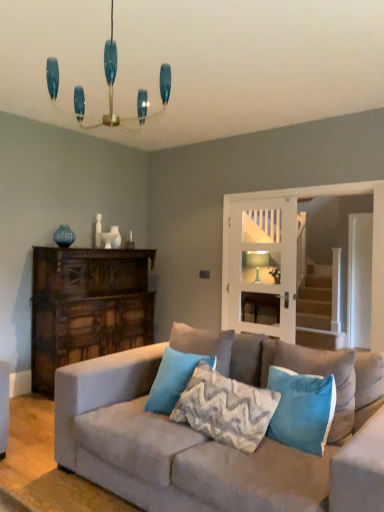
Identify the location of textured gray pillow at center, marked as the 3th pillow in a left-to-right arrangement. The height and width of the screenshot is (512, 384). (226, 409).

At what (x,y) coordinates should I click in order to perform the action: click on dark brown wood dresser at left. Please return your answer as a coordinate pair (x, y). The image size is (384, 512). Looking at the image, I should click on (87, 307).

The height and width of the screenshot is (512, 384). Describe the element at coordinates (204, 344) in the screenshot. I see `velvet blue pillow at center, arranged as the 2th pillow when viewed from the left` at that location.

Describe the element at coordinates (261, 263) in the screenshot. I see `white glass door at center` at that location.

Identify the location of teal glass chandelier at upper center. The width and height of the screenshot is (384, 512). (112, 92).

Identify the location of suede couch at center. (209, 446).

Identify the location of textured gray pillow at center, marked as the 3th pillow in a left-to-right arrangement. (226, 409).

From a real-world perspective, is suede couch at center beneath translucent glass candlestick at center?

Yes.

Does point (143, 481) appear closer or farther from the camera than point (256, 264)?

Point (143, 481) is closer to the camera than point (256, 264).

Looking at this image, is suede couch at center situated inside translucent glass candlestick at center or outside?

suede couch at center is not inside translucent glass candlestick at center, it's outside.

From the image's perspective, which is above, white glass door at center or velvet blue pillow at center, the 3th pillow in the right-to-left sequence?

From the image's view, white glass door at center is above.

From a real-world perspective, is white glass door at center positioned over velvet blue pillow at center, the 3th pillow in the right-to-left sequence, based on gravity?

Yes.

How different are the orientations of white glass door at center and velvet blue pillow at center, the 3th pillow in the right-to-left sequence, in degrees?

The facing directions of white glass door at center and velvet blue pillow at center, the 3th pillow in the right-to-left sequence, are 1.64 degrees apart.

Is white glass door at center positioned far away from velvet blue pillow at center, the 3th pillow in the right-to-left sequence?

Indeed, white glass door at center is not near velvet blue pillow at center, the 3th pillow in the right-to-left sequence.

Considering the sizes of teal velvet pillow at center, marked as the 1th pillow in a left-to-right arrangement, and suede couch at center in the image, is teal velvet pillow at center, marked as the 1th pillow in a left-to-right arrangement, taller or shorter than suede couch at center?

Considering their sizes, teal velvet pillow at center, marked as the 1th pillow in a left-to-right arrangement, has less height than suede couch at center.

Is teal velvet pillow at center, which appears as the 4th pillow when viewed from the right, facing away from suede couch at center?

Yes, teal velvet pillow at center, which appears as the 4th pillow when viewed from the right, is facing away from suede couch at center.

Who is more distant, teal velvet pillow at center, which appears as the 4th pillow when viewed from the right, or suede couch at center?

teal velvet pillow at center, which appears as the 4th pillow when viewed from the right.

Which is behind, point (191, 357) or point (332, 362)?

The point (191, 357) is farther.

Is point (40, 290) farther from viewer compared to point (250, 445)?

Yes, point (40, 290) is farther from viewer.

Between dark brown wood dresser at left and textured gray pillow at center, the second pillow viewed from the right, which one appears on the right side from the viewer's perspective?

From the viewer's perspective, textured gray pillow at center, the second pillow viewed from the right, appears more on the right side.

From the picture: From the image's perspective, is dark brown wood dresser at left positioned above or below textured gray pillow at center, the second pillow viewed from the right?

Based on their image positions, dark brown wood dresser at left is located above textured gray pillow at center, the second pillow viewed from the right.

Does dark brown wood dresser at left turn towards textured gray pillow at center, the second pillow viewed from the right?

Yes, dark brown wood dresser at left is turned towards textured gray pillow at center, the second pillow viewed from the right.

Is point (254, 288) positioned in front of point (211, 360)?

No.

Considering the relative positions of white glass door at center and teal velvet pillow at center, which appears as the 4th pillow when viewed from the right, in the image provided, is white glass door at center to the right of teal velvet pillow at center, which appears as the 4th pillow when viewed from the right, from the viewer's perspective?

Correct, you'll find white glass door at center to the right of teal velvet pillow at center, which appears as the 4th pillow when viewed from the right.

Considering the relative sizes of white glass door at center and teal velvet pillow at center, marked as the 1th pillow in a left-to-right arrangement, in the image provided, is white glass door at center taller than teal velvet pillow at center, marked as the 1th pillow in a left-to-right arrangement,?

Yes, white glass door at center is taller than teal velvet pillow at center, marked as the 1th pillow in a left-to-right arrangement.

Find the location of a particular element. the 2nd pillow in front when counting from the white glass door at center is located at coordinates (173, 379).

From the picture: Between teal velvet pillow at center, marked as the 1th pillow in a left-to-right arrangement, and white glass door at center, which one has smaller size?

teal velvet pillow at center, marked as the 1th pillow in a left-to-right arrangement.

Is teal velvet pillow at center, which appears as the 4th pillow when viewed from the right, facing towards white glass door at center?

No, teal velvet pillow at center, which appears as the 4th pillow when viewed from the right, is not aimed at white glass door at center.

Between teal velvet pillow at center, which appears as the 4th pillow when viewed from the right, and white glass door at center, which one has smaller width?

white glass door at center.

From a real-world perspective, is suede couch at center positioned under velvet blue pillow at center, the 3th pillow in the right-to-left sequence, based on gravity?

Yes.

The height and width of the screenshot is (512, 384). Identify the location of the 4th pillow positioned above the suede couch at center (from a real-world perspective). (204, 344).

In the scene shown: Considering the sizes of suede couch at center and velvet blue pillow at center, arranged as the 2th pillow when viewed from the left, in the image, is suede couch at center bigger or smaller than velvet blue pillow at center, arranged as the 2th pillow when viewed from the left,?

suede couch at center is bigger than velvet blue pillow at center, arranged as the 2th pillow when viewed from the left.

Does suede couch at center have a greater height compared to velvet blue pillow at center, the 3th pillow in the right-to-left sequence?

Correct, suede couch at center is much taller as velvet blue pillow at center, the 3th pillow in the right-to-left sequence.

Identify the location of studio couch that appears on the left of translucent glass candlestick at center. The height and width of the screenshot is (512, 384). (209, 446).

The width and height of the screenshot is (384, 512). Identify the location of glass door on the right of velvet blue pillow at center, arranged as the 2th pillow when viewed from the left. (261, 263).

Looking at the image, which one is located closer to suede couch at center, translucent glass candlestick at center or teal velvet pillow at center, which appears as the 4th pillow when viewed from the right?

Among the two, teal velvet pillow at center, which appears as the 4th pillow when viewed from the right, is located nearer to suede couch at center.

Based on their spatial positions, is teal velvet pillow at center, placed as the fourth pillow when sorted from left to right, or velvet blue pillow at center, the 3th pillow in the right-to-left sequence, closer to white glass door at center?

velvet blue pillow at center, the 3th pillow in the right-to-left sequence, is closer to white glass door at center.

Looking at the image, which one is located closer to teal glass chandelier at upper center, teal velvet pillow at center, the 1th pillow positioned from the right, or translucent glass candlestick at center?

The object closer to teal glass chandelier at upper center is translucent glass candlestick at center.

In the scene shown: Which object lies nearer to the anchor point translucent glass candlestick at center, suede couch at center or velvet blue pillow at center, the 3th pillow in the right-to-left sequence?

velvet blue pillow at center, the 3th pillow in the right-to-left sequence.

When comparing their distances from teal glass chandelier at upper center, does velvet blue pillow at center, arranged as the 2th pillow when viewed from the left, or teal velvet pillow at center, marked as the 1th pillow in a left-to-right arrangement, seem further?

teal velvet pillow at center, marked as the 1th pillow in a left-to-right arrangement, is positioned further to the anchor teal glass chandelier at upper center.

Estimate the real-world distances between objects in this image. Which object is closer to suede couch at center, dark brown wood dresser at left or teal glass chandelier at upper center?

The object closer to suede couch at center is dark brown wood dresser at left.

Estimate the real-world distances between objects in this image. Which object is further from dark brown wood dresser at left, teal velvet pillow at center, which appears as the 4th pillow when viewed from the right, or textured gray pillow at center, marked as the 3th pillow in a left-to-right arrangement?

textured gray pillow at center, marked as the 3th pillow in a left-to-right arrangement, lies further to dark brown wood dresser at left than the other object.

Considering their positions, is translucent glass candlestick at center positioned further to white glass door at center than velvet blue pillow at center, the 3th pillow in the right-to-left sequence?

Based on the image, velvet blue pillow at center, the 3th pillow in the right-to-left sequence, appears to be further to white glass door at center.

At what (x,y) coordinates should I click in order to perform the action: click on glass door located between velvet blue pillow at center, arranged as the 2th pillow when viewed from the left, and translucent glass candlestick at center in the depth direction. Please return your answer as a coordinate pair (x, y). Looking at the image, I should click on (261, 263).

I want to click on glass door positioned between dark brown wood dresser at left and translucent glass candlestick at center from near to far, so click(261, 263).

Image resolution: width=384 pixels, height=512 pixels. Identify the location of dresser between textured gray pillow at center, the second pillow viewed from the right, and translucent glass candlestick at center in the front-back direction. (87, 307).

This screenshot has height=512, width=384. Find the location of `dresser positioned between textured gray pillow at center, marked as the 3th pillow in a left-to-right arrangement, and white glass door at center from near to far`. dresser positioned between textured gray pillow at center, marked as the 3th pillow in a left-to-right arrangement, and white glass door at center from near to far is located at coordinates (87, 307).